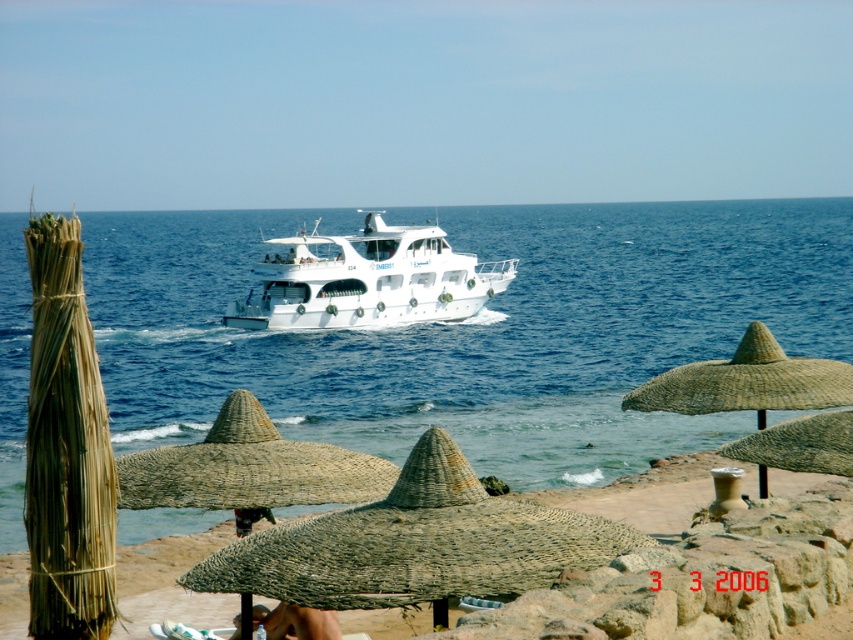
You are standing on the beach looking at the scene. There is a point marked at coordinates point (x=473, y=328). What is located at that point?

The point (x=473, y=328) indicates blue water at center.

You are standing on the beach and want to know which object is higher between the blue water at center and the natural straw umbrella at center. Based on the scene, which one is taller?

The blue water at center is taller than the natural straw umbrella at center according to the scene description.